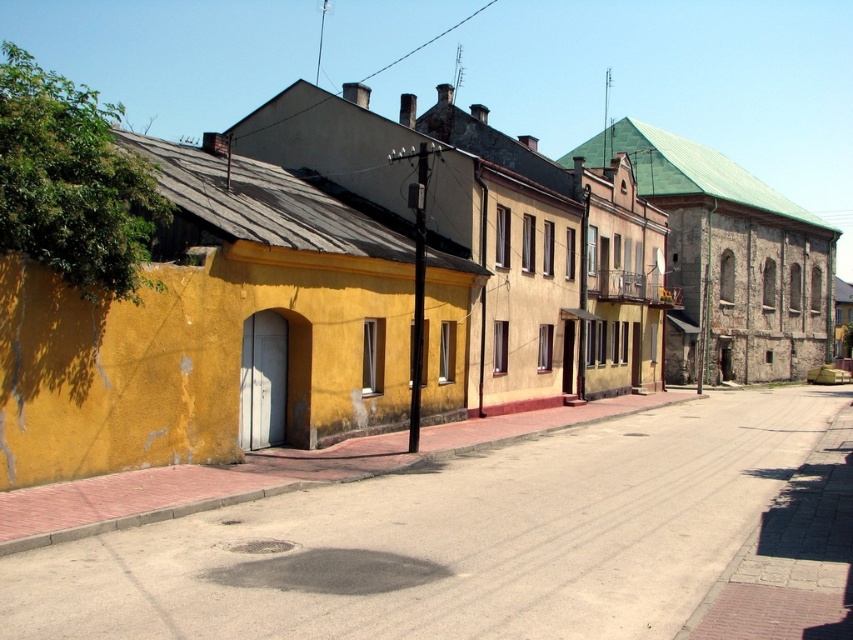
You are a delivery person trying to navigate through the town. You see the yellow matte building at left and the smooth concrete alley at center. Which one is closer to you?

The yellow matte building at left is positioned over the smooth concrete alley at center, so the yellow matte building at left is closer to you.

You are a delivery driver who needs to park your van that is 2 meters wide. You see the yellow matte building at left and the smooth concrete alley at center. Which location can accommodate your van?

The yellow matte building at left has a larger width than the smooth concrete alley at center, so the van can park at the yellow matte building at left.

You are a delivery driver approaching the yellow matte building at left and the smooth concrete alley at center. Which structure is closer to you as you drive along the road?

The yellow matte building at left is closer to you because the smooth concrete alley at center is positioned behind it.